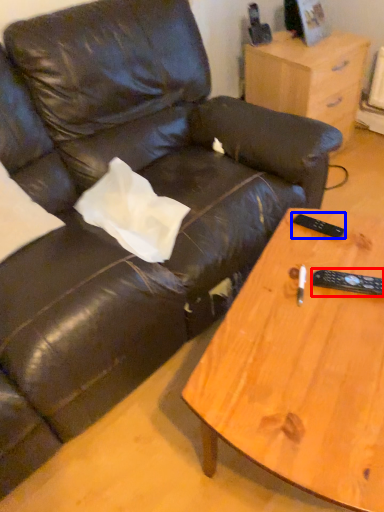
Question: Which object is further to the camera taking this photo, remote (highlighted by a red box) or remote (highlighted by a blue box)?

Choices:
 (A) remote
 (B) remote

Answer: (B)